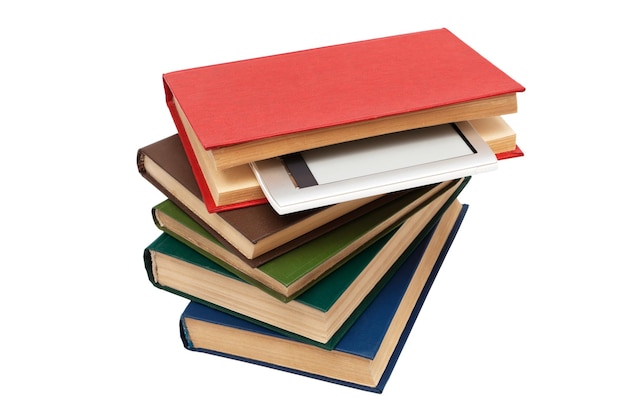
At what (x,y) coordinates should I click in order to perform the action: click on book spines. Please return your answer as a coordinate pair (x, y). The height and width of the screenshot is (417, 626). Looking at the image, I should click on (162, 91), (139, 163), (158, 222), (150, 267), (185, 342).